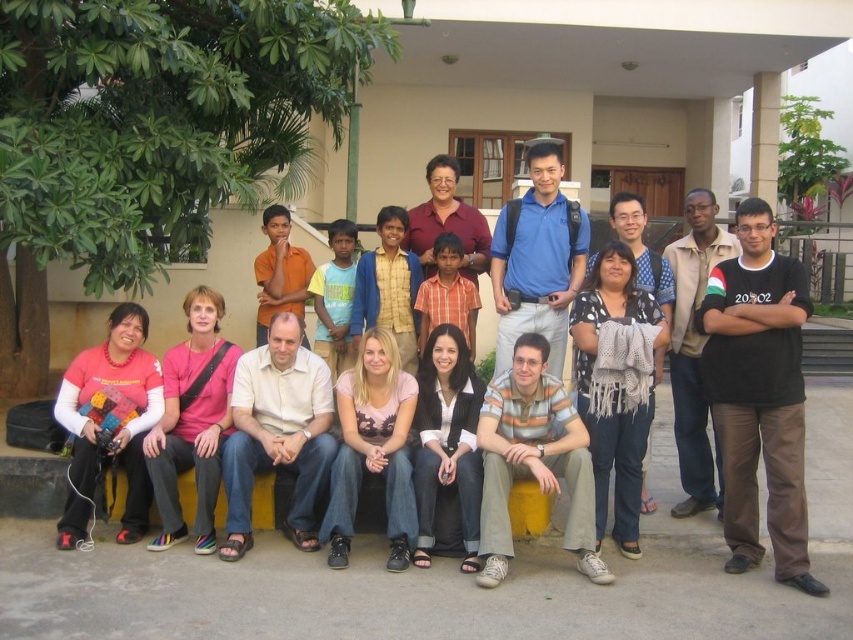
Question: Can you confirm if matte black jacket at center is positioned below knitted gray scarf at center?

Choices:
 (A) no
 (B) yes

Answer: (B)

Question: Which object is positioned farthest from the pink cotton shirt at center?

Choices:
 (A) knitted gray scarf at center
 (B) matte black jacket at center
 (C) pink fabric shirt at center

Answer: (A)

Question: Is pink fabric shirt at center to the right of matte black jacket at center from the viewer's perspective?

Choices:
 (A) no
 (B) yes

Answer: (A)

Question: Estimate the real-world distances between objects in this image. Which object is closer to the pink fabric shirt at center?

Choices:
 (A) matte black jacket at center
 (B) pink fabric shirt at lower left
 (C) knitted gray scarf at center
 (D) pink cotton shirt at center

Answer: (B)

Question: Does pink fabric shirt at lower left have a larger size compared to pink fabric shirt at center?

Choices:
 (A) no
 (B) yes

Answer: (B)

Question: Considering the real-world distances, which object is closest to the pink fabric shirt at center?

Choices:
 (A) matte black jacket at center
 (B) pink fabric shirt at lower left
 (C) knitted gray scarf at center

Answer: (B)